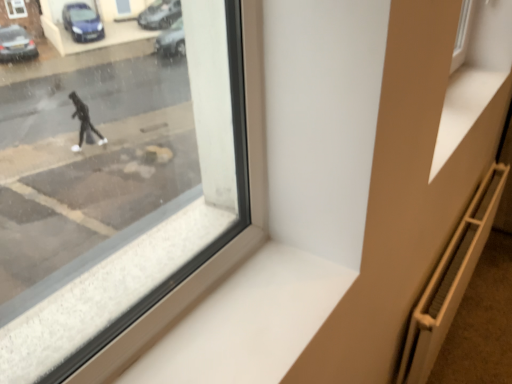
Question: From a real-world perspective, is brown textured radiator at lower right positioned above or below white smooth window sill at lower center?

Choices:
 (A) above
 (B) below

Answer: (B)

Question: Is brown textured radiator at lower right wider or thinner than white smooth window sill at lower center?

Choices:
 (A) wide
 (B) thin

Answer: (A)

Question: Estimate the real-world distances between objects in this image. Which object is closer to the brown textured radiator at lower right?

Choices:
 (A) metallic radiator at lower right
 (B) white smooth window sill at lower center

Answer: (A)

Question: Estimate the real-world distances between objects in this image. Which object is closer to the brown textured radiator at lower right?

Choices:
 (A) white smooth window sill at lower center
 (B) metallic radiator at lower right

Answer: (B)